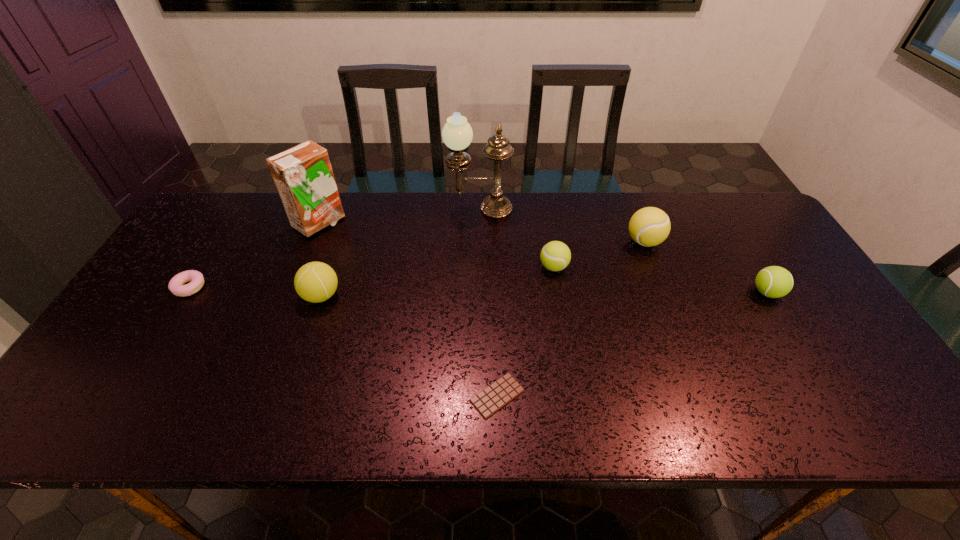
Locate an element on the screen. Image resolution: width=960 pixels, height=540 pixels. empty space between the second shortest object and the rightmost tennis ball is located at coordinates (478, 290).

Where is `object that is the closest to the leftmost object`? The width and height of the screenshot is (960, 540). object that is the closest to the leftmost object is located at coordinates (303, 176).

The width and height of the screenshot is (960, 540). In order to click on object that can be found as the second closest to the leftmost tennis ball in this screenshot , I will do `click(176, 286)`.

Image resolution: width=960 pixels, height=540 pixels. I want to click on tennis ball that is the fourth nearest to the candy bar, so click(x=773, y=281).

At what (x,y) coordinates should I click in order to perform the action: click on tennis ball that can be found as the third closest to the leftmost tennis ball. Please return your answer as a coordinate pair (x, y). The height and width of the screenshot is (540, 960). Looking at the image, I should click on (773, 281).

You are a GUI agent. You are given a task and a screenshot of the screen. Output one action in this format:
    pyautogui.click(x=<x>, y=<y>)
    Task: Click on the free location that satisfies the following two spatial constraints: 1. on the front side of the oil lamp; 2. on the straw side of the second tallest object
    This screenshot has width=960, height=540.
    Given the screenshot: What is the action you would take?
    pyautogui.click(x=479, y=224)

Locate an element on the screen. This screenshot has height=540, width=960. free space that satisfies the following two spatial constraints: 1. on the straw side of the second tallest object; 2. on the front side of the leftmost object is located at coordinates (293, 288).

Identify the location of free space that satisfies the following two spatial constraints: 1. on the straw side of the rightmost object; 2. on the right side of the carton. (291, 293).

Image resolution: width=960 pixels, height=540 pixels. What are the coordinates of `free location that satisfies the following two spatial constraints: 1. on the straw side of the carton; 2. on the left side of the second farthest tennis ball` in the screenshot? It's located at (301, 267).

Locate an element on the screen. free space in the image that satisfies the following two spatial constraints: 1. on the back side of the leftmost tennis ball; 2. on the right side of the rightmost tennis ball is located at coordinates (323, 293).